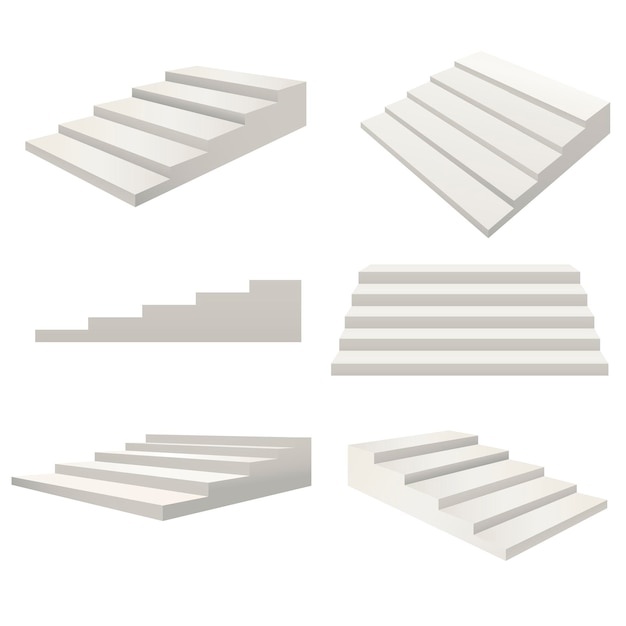
In order to click on sets of stairs in this screenshot , I will do `click(170, 481)`, `click(243, 290)`, `click(437, 294)`, `click(464, 474)`, `click(168, 116)`, `click(498, 128)`.